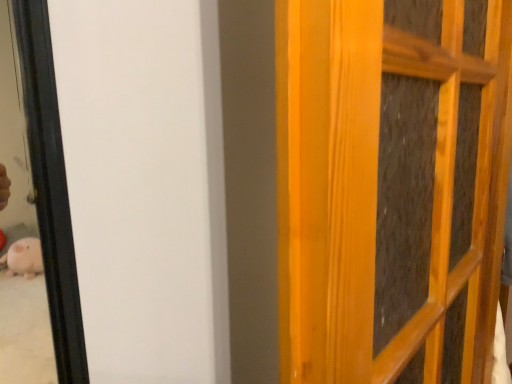
This screenshot has height=384, width=512. Describe the element at coordinates (391, 187) in the screenshot. I see `wooden door at right` at that location.

The height and width of the screenshot is (384, 512). Identify the location of wooden door at right. (391, 187).

This screenshot has width=512, height=384. I want to click on wooden door at right, so click(391, 187).